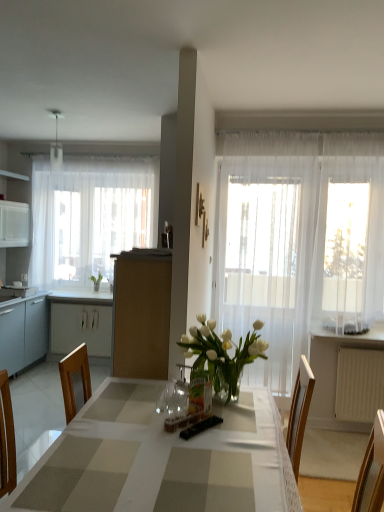
Where is `free area behind translucent glass vase at center`? The height and width of the screenshot is (512, 384). free area behind translucent glass vase at center is located at coordinates (211, 400).